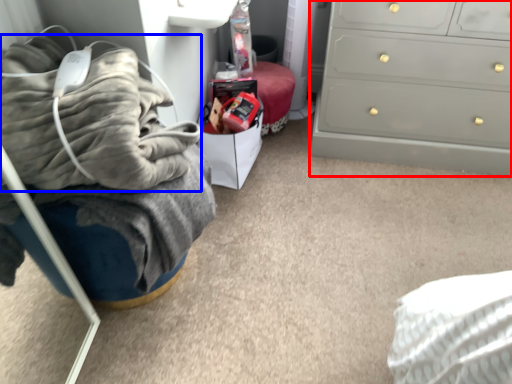
Question: Which point is further to the camera, chest of drawers (highlighted by a red box) or blanket (highlighted by a blue box)?

Choices:
 (A) chest of drawers
 (B) blanket

Answer: (A)